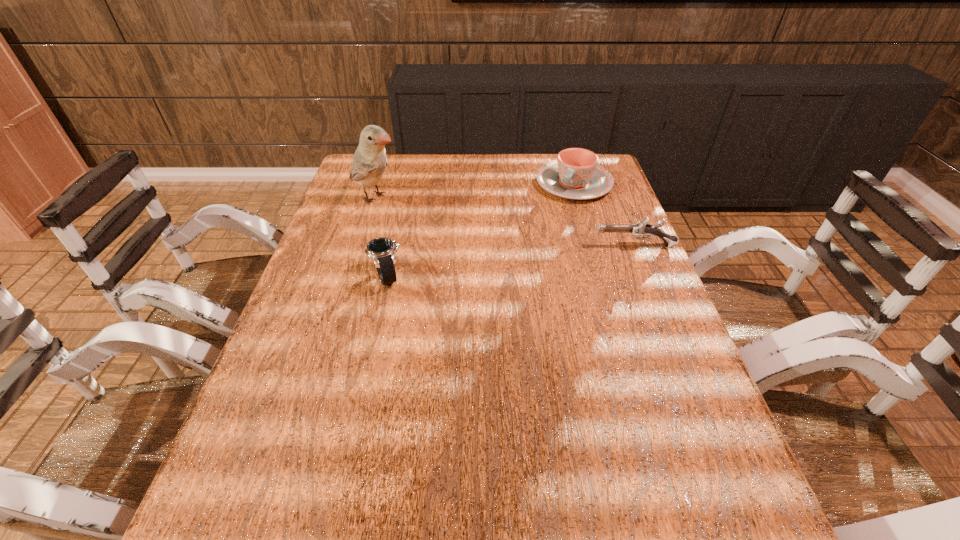
The height and width of the screenshot is (540, 960). I want to click on free space on the desktop that is between the watch and the gun and is positioned on the handle side of the chinaware, so click(524, 260).

Find the location of a particular element. The width and height of the screenshot is (960, 540). free space on the desktop that is between the watch and the third farthest object and is positioned at the face of the tallest object is located at coordinates (516, 261).